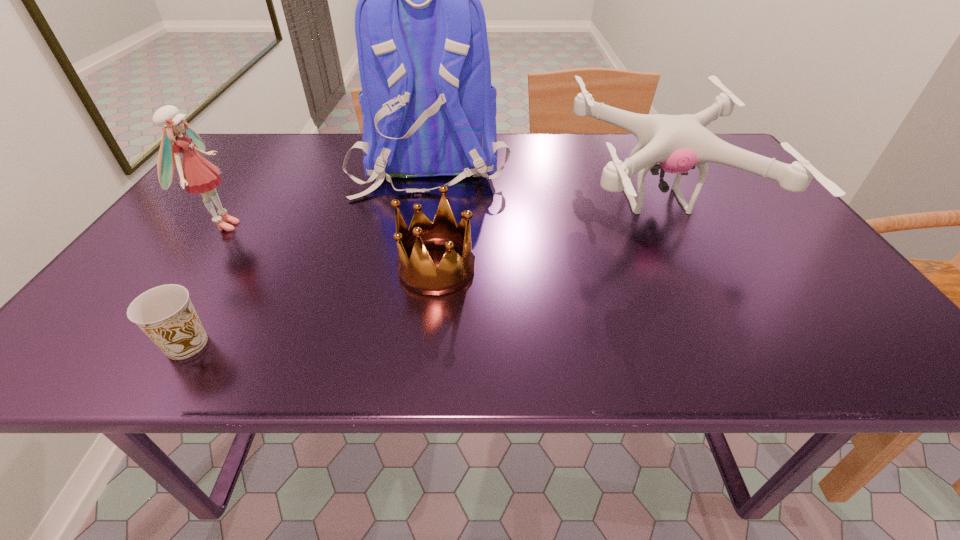
Locate an element on the screen. vacant space that satisfies the following two spatial constraints: 1. on the front-facing side of the shortest object; 2. on the left side of the doll is located at coordinates (138, 345).

Locate an element on the screen. free spot that satisfies the following two spatial constraints: 1. on the front-facing side of the fourth shortest object; 2. on the left side of the crown is located at coordinates (193, 267).

Find the location of a particular element. The width and height of the screenshot is (960, 540). vacant position in the image that satisfies the following two spatial constraints: 1. on the front-facing side of the fourth shortest object; 2. on the left side of the shortest object is located at coordinates (138, 345).

The height and width of the screenshot is (540, 960). In order to click on blank space that satisfies the following two spatial constraints: 1. on the back side of the second shortest object; 2. on the right side of the shortest object in this screenshot , I will do `click(234, 267)`.

The width and height of the screenshot is (960, 540). I want to click on vacant space that satisfies the following two spatial constraints: 1. on the front-facing side of the fourth shortest object; 2. on the back side of the crown, so click(193, 267).

The image size is (960, 540). Identify the location of vacant space that satisfies the following two spatial constraints: 1. on the front-facing side of the crown; 2. on the left side of the second tallest object. (193, 267).

The width and height of the screenshot is (960, 540). I want to click on free space that satisfies the following two spatial constraints: 1. on the front-facing side of the fourth tallest object; 2. on the right side of the doll, so click(x=193, y=267).